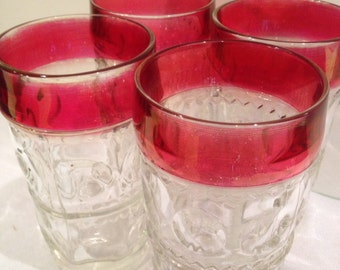
Where is `red glass area at the top of a drinking glass`? red glass area at the top of a drinking glass is located at coordinates (71, 112).